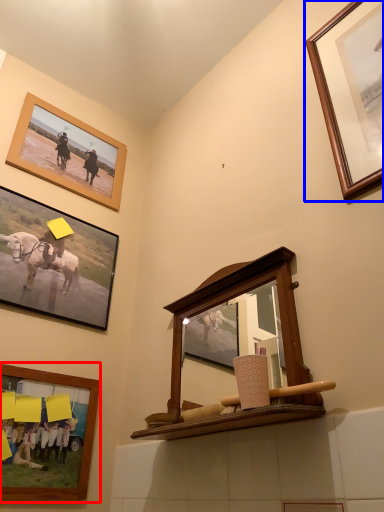
Question: Which object is further to the camera taking this photo, picture frame (highlighted by a red box) or picture frame (highlighted by a blue box)?

Choices:
 (A) picture frame
 (B) picture frame

Answer: (A)